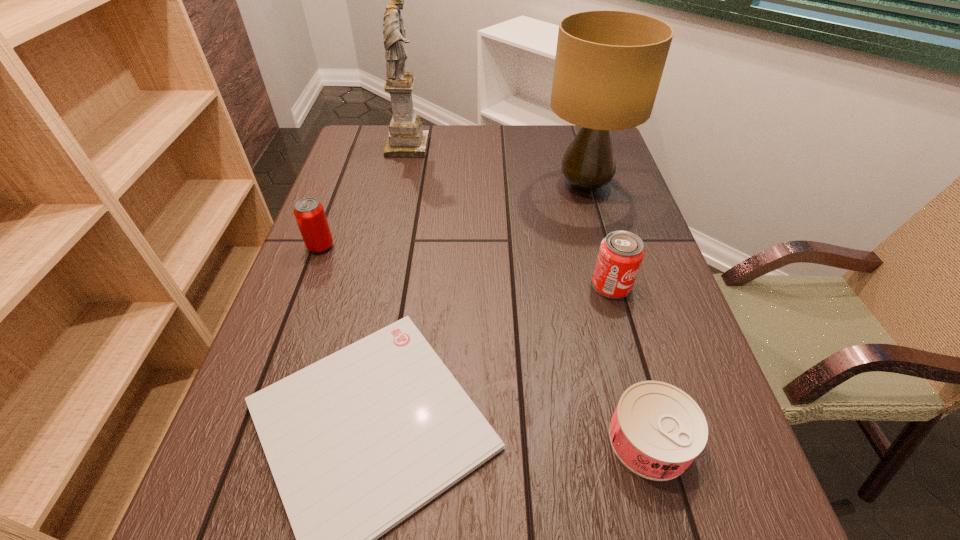
Identify the location of empty space that is in between the second farthest object and the nearest can. The width and height of the screenshot is (960, 540). (617, 313).

Locate an element on the screen. This screenshot has height=540, width=960. object that is the second nearest to the shortest object is located at coordinates (309, 213).

Where is `object that is the fourth nearest to the lampshade`? The image size is (960, 540). object that is the fourth nearest to the lampshade is located at coordinates click(x=309, y=213).

Identify the location of can that stands as the second closest to the second farthest can. (309, 213).

Locate which can ranks third in proximity to the shortest object. Please provide its 2D coordinates. Your answer should be formatted as a tuple, i.e. [(x, y)], where the tuple contains the x and y coordinates of a point satisfying the conditions above.

[(621, 253)]

This screenshot has height=540, width=960. Identify the location of free spot that satisfies the following two spatial constraints: 1. on the back side of the fifth nearest object; 2. on the front-facing side of the sculpture. (x=573, y=147).

At what (x,y) coordinates should I click in order to perform the action: click on vacant area in the image that satisfies the following two spatial constraints: 1. on the front side of the farthest can; 2. on the right side of the nearest can. Please return your answer as a coordinate pair (x, y). The image size is (960, 540). Looking at the image, I should click on (249, 440).

Identify the location of free space in the image that satisfies the following two spatial constraints: 1. on the front-facing side of the sculpture; 2. on the left side of the fifth tallest object. [342, 440].

Identify the location of vacant position in the image that satisfies the following two spatial constraints: 1. on the front-facing side of the fourth farthest object; 2. on the left side of the sculpture. Image resolution: width=960 pixels, height=540 pixels. (376, 285).